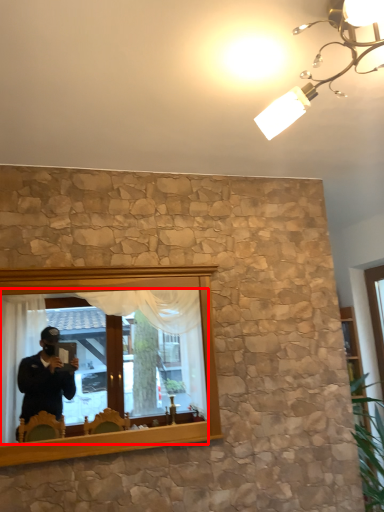
Question: From the image's perspective, considering the relative positions of mirror (annotated by the red box) and light fixture in the image provided, where is mirror (annotated by the red box) located with respect to the staircase?

Choices:
 (A) above
 (B) below

Answer: (B)